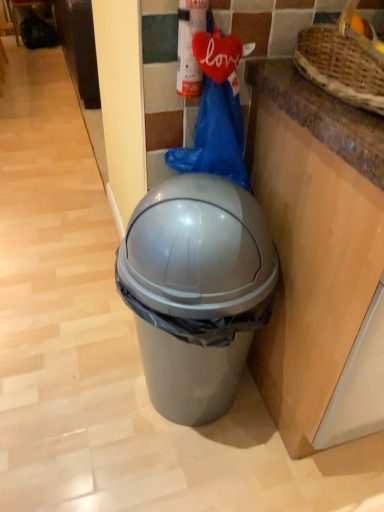
The width and height of the screenshot is (384, 512). Describe the element at coordinates (342, 62) in the screenshot. I see `brown woven basket at upper right` at that location.

The height and width of the screenshot is (512, 384). Identify the location of brown woven basket at upper right. (342, 62).

Where is `metallic silver extinguisher at upper center`? metallic silver extinguisher at upper center is located at coordinates (189, 46).

What is the approximate width of matte gray trash can at center?

matte gray trash can at center is 16.47 inches in width.

Identify the location of brown woven basket at upper right. (342, 62).

Is metallic silver extinguisher at upper center situated inside matte gray trash can at center or outside?

metallic silver extinguisher at upper center is located beyond the bounds of matte gray trash can at center.

Does metallic silver extinguisher at upper center have a larger size compared to matte gray trash can at center?

No.

Would you say metallic silver extinguisher at upper center is a long distance from matte gray trash can at center?

No, metallic silver extinguisher at upper center is not far away from matte gray trash can at center.

In terms of height, does matte gray trash can at center look taller or shorter compared to metallic silver extinguisher at upper center?

matte gray trash can at center is taller than metallic silver extinguisher at upper center.

Which object is more forward, matte gray trash can at center or metallic silver extinguisher at upper center?

matte gray trash can at center is closer to the camera.

Image resolution: width=384 pixels, height=512 pixels. Identify the location of extinguisher that appears above the matte gray trash can at center (from the image's perspective). [189, 46].

Can you confirm if metallic silver extinguisher at upper center is wider than brown woven basket at upper right?

Incorrect, the width of metallic silver extinguisher at upper center does not surpass that of brown woven basket at upper right.

Considering the positions of points (193, 28) and (381, 85), is point (193, 28) closer to camera compared to point (381, 85)?

No, it is behind (381, 85).

You are a GUI agent. You are given a task and a screenshot of the screen. Output one action in this format:
    pyautogui.click(x=<x>, y=<y>)
    Task: Click on the basket above the metallic silver extinguisher at upper center (from a real-world perspective)
    
    Given the screenshot: What is the action you would take?
    pyautogui.click(x=342, y=62)

Can you confirm if brown woven basket at upper right is positioned to the right of metallic silver extinguisher at upper center?

Indeed, brown woven basket at upper right is positioned on the right side of metallic silver extinguisher at upper center.

From a real-world perspective, is brown woven basket at upper right beneath metallic silver extinguisher at upper center?

Incorrect, from a real-world perspective, brown woven basket at upper right is higher than metallic silver extinguisher at upper center.

Considering the sizes of objects brown woven basket at upper right and metallic silver extinguisher at upper center in the image provided, who is shorter, brown woven basket at upper right or metallic silver extinguisher at upper center?

brown woven basket at upper right.

Considering the sizes of brown woven basket at upper right and metallic silver extinguisher at upper center in the image, is brown woven basket at upper right wider or thinner than metallic silver extinguisher at upper center?

In the image, brown woven basket at upper right appears to be wider than metallic silver extinguisher at upper center.

Looking at this image, from a real-world perspective, is brown woven basket at upper right physically below matte gray trash can at center?

Actually, brown woven basket at upper right is physically above matte gray trash can at center in the real world.

In order to click on waste container below the brown woven basket at upper right (from a real-world perspective) in this screenshot , I will do `click(196, 291)`.

Which is in front, point (300, 72) or point (147, 217)?

The point (147, 217) is closer to the camera.

Does matte gray trash can at center have a greater width compared to brown woven basket at upper right?

In fact, matte gray trash can at center might be narrower than brown woven basket at upper right.

In the scene shown: From the image's perspective, relative to brown woven basket at upper right, is matte gray trash can at center above or below?

matte gray trash can at center is below brown woven basket at upper right.

Is there a large distance between matte gray trash can at center and brown woven basket at upper right?

That's not correct — matte gray trash can at center is a little close to brown woven basket at upper right.

This screenshot has height=512, width=384. What are the coordinates of `extinguisher on the right side of matte gray trash can at center` in the screenshot? It's located at (189, 46).

This screenshot has height=512, width=384. In the image, there is a metallic silver extinguisher at upper center. Identify the location of waste container below it (from the image's perspective). (196, 291).

Estimate the real-world distances between objects in this image. Which object is further from brown woven basket at upper right, matte gray trash can at center or metallic silver extinguisher at upper center?

Among the two, matte gray trash can at center is located further to brown woven basket at upper right.

Which object lies nearer to the anchor point metallic silver extinguisher at upper center, matte gray trash can at center or brown woven basket at upper right?

The object closer to metallic silver extinguisher at upper center is brown woven basket at upper right.

Based on the photo, which object lies nearer to the anchor point matte gray trash can at center, brown woven basket at upper right or metallic silver extinguisher at upper center?

Based on the image, metallic silver extinguisher at upper center appears to be nearer to matte gray trash can at center.

Estimate the real-world distances between objects in this image. Which object is further from matte gray trash can at center, metallic silver extinguisher at upper center or brown woven basket at upper right?

brown woven basket at upper right is further to matte gray trash can at center.

Considering their positions, is brown woven basket at upper right positioned further to metallic silver extinguisher at upper center than matte gray trash can at center?

matte gray trash can at center.

From the image, which object appears to be farther from brown woven basket at upper right, metallic silver extinguisher at upper center or matte gray trash can at center?

matte gray trash can at center is further to brown woven basket at upper right.

Image resolution: width=384 pixels, height=512 pixels. Find the location of `basket between metallic silver extinguisher at upper center and matte gray trash can at center vertically`. basket between metallic silver extinguisher at upper center and matte gray trash can at center vertically is located at coordinates (342, 62).